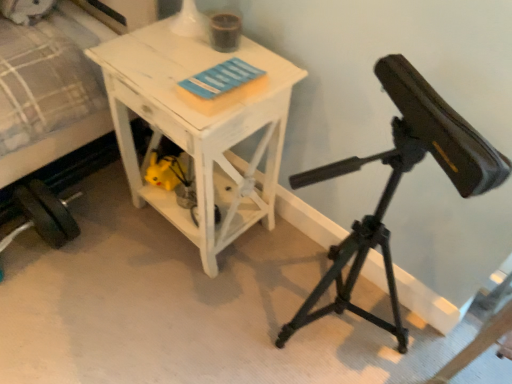
Locate an element on the screen. This screenshot has width=512, height=384. vacant space situated on the left part of black matte tripod at right is located at coordinates (234, 320).